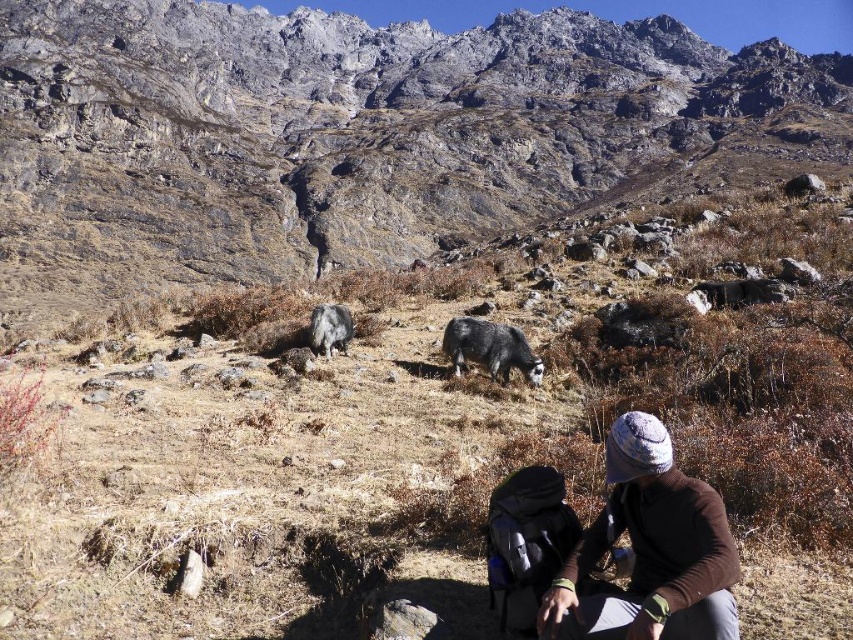
Question: Considering the real-world distances, which object is closest to the gray woolen yak at center?

Choices:
 (A) brown woolen hat at lower right
 (B) fuzzy gray goat at center
 (C) gray rocky mountain at center

Answer: (B)

Question: Can you confirm if gray woolen yak at center is bigger than fuzzy gray goat at center?

Choices:
 (A) yes
 (B) no

Answer: (A)

Question: Among these points, which one is nearest to the camera?

Choices:
 (A) (338, 310)
 (B) (563, 588)
 (C) (27, 195)
 (D) (518, 364)

Answer: (B)

Question: Which point appears closest to the camera in this image?

Choices:
 (A) (149, 36)
 (B) (646, 568)

Answer: (B)

Question: Is brown woolen hat at lower right bigger than gray woolen yak at center?

Choices:
 (A) no
 (B) yes

Answer: (B)

Question: Does brown woolen hat at lower right appear under fuzzy gray goat at center?

Choices:
 (A) no
 (B) yes

Answer: (B)